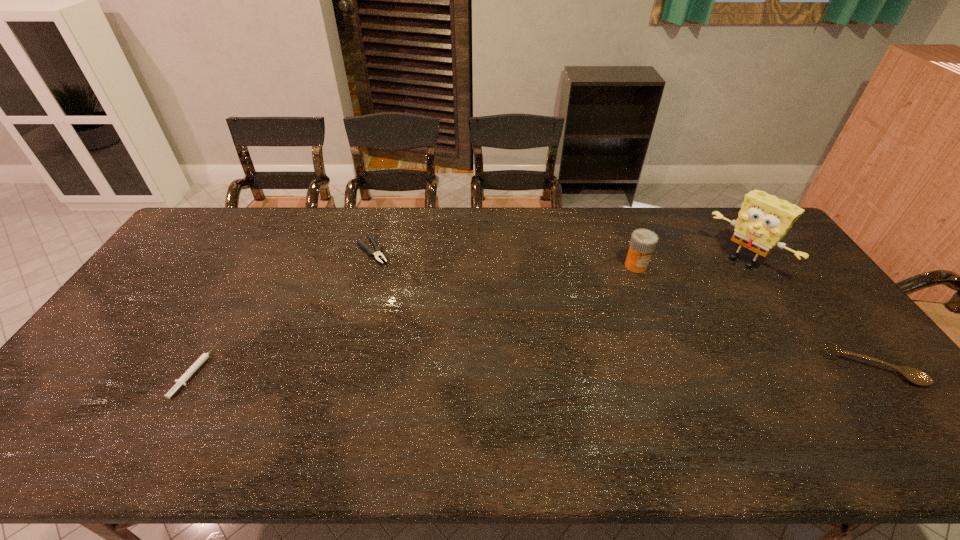
Identify the location of vacant space located on the face of the tallest object. This screenshot has width=960, height=540. (672, 325).

This screenshot has width=960, height=540. In order to click on vacant point located 0.200m on the label side of the fourth shortest object in this screenshot , I will do `click(632, 319)`.

This screenshot has height=540, width=960. I want to click on vacant space located on the label side of the fourth shortest object, so click(629, 342).

At what (x,y) coordinates should I click in order to perform the action: click on vacant region located 0.080m on the label side of the fourth shortest object. Please return your answer as a coordinate pair (x, y). Looking at the image, I should click on (634, 291).

The image size is (960, 540). In order to click on free region located at the gripping part of the pliers in this screenshot , I will do `click(428, 322)`.

Find the location of a particular element. The width and height of the screenshot is (960, 540). vacant space positioned 0.170m at the gripping part of the pliers is located at coordinates (405, 294).

This screenshot has width=960, height=540. I want to click on vacant area located at the gripping part of the pliers, so click(420, 312).

Locate an element on the screen. sponge positioned at the far edge is located at coordinates (764, 219).

At what (x,y) coordinates should I click in order to perform the action: click on pliers situated at the far edge. Please return your answer as a coordinate pair (x, y). The height and width of the screenshot is (540, 960). Looking at the image, I should click on (378, 249).

This screenshot has width=960, height=540. I want to click on syringe that is at the near edge, so click(182, 380).